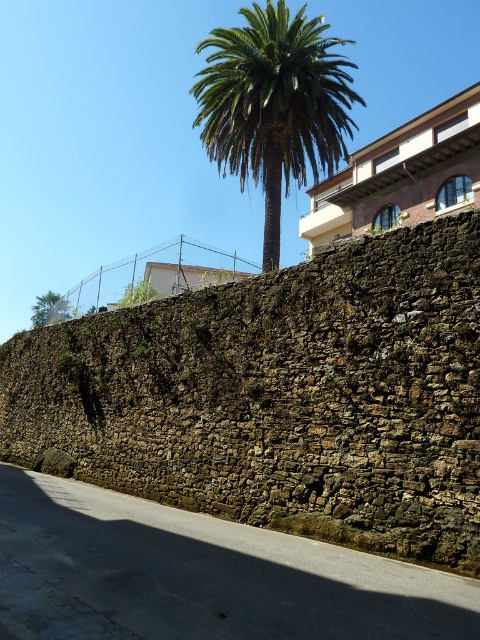
Question: Is green leafy palm at upper left thinner than green leafy tree at upper center?

Choices:
 (A) no
 (B) yes

Answer: (A)

Question: Among these objects, which one is farthest from the camera?

Choices:
 (A) green leafy palm at upper center
 (B) green leafy palm at upper left

Answer: (B)

Question: Which of the following is the closest to the observer?

Choices:
 (A) green leafy palm at upper center
 (B) green leafy tree at upper center
 (C) green leafy palm at upper left

Answer: (B)

Question: Can you confirm if green leafy palm at upper center is positioned to the right of green leafy tree at upper center?

Choices:
 (A) yes
 (B) no

Answer: (A)

Question: Which point is farther to the camera?

Choices:
 (A) (245, 58)
 (B) (130, 285)

Answer: (B)

Question: Can you confirm if green leafy palm at upper center is thinner than green leafy tree at upper center?

Choices:
 (A) yes
 (B) no

Answer: (B)